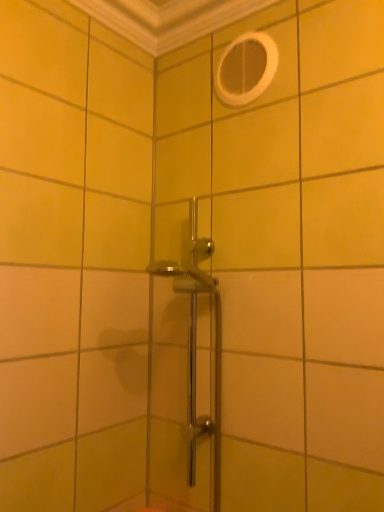
The width and height of the screenshot is (384, 512). What do you see at coordinates (246, 68) in the screenshot?
I see `white plastic hole at upper center` at bounding box center [246, 68].

Where is `white plastic hole at upper center`? white plastic hole at upper center is located at coordinates (246, 68).

Locate an element on the screen. This screenshot has width=384, height=512. white plastic hole at upper center is located at coordinates tap(246, 68).